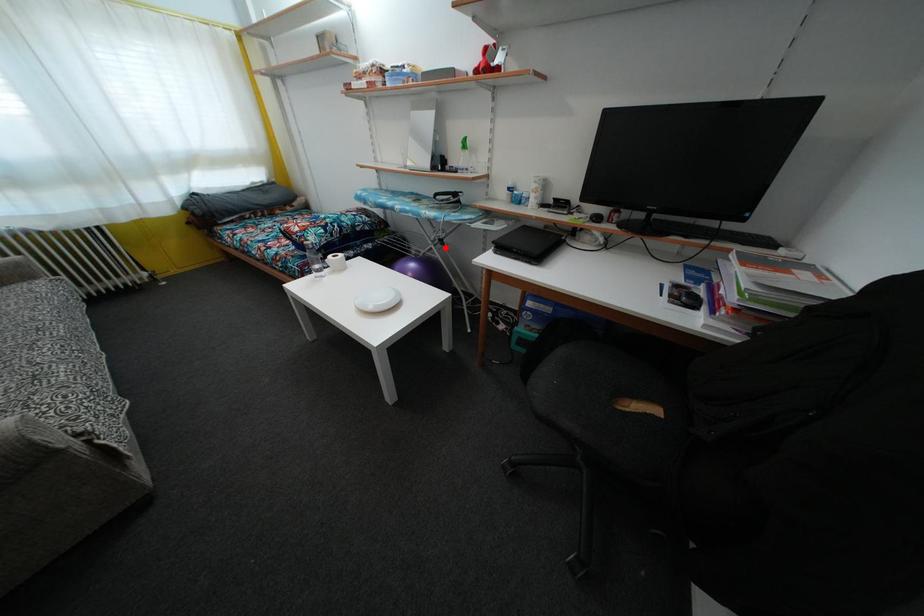
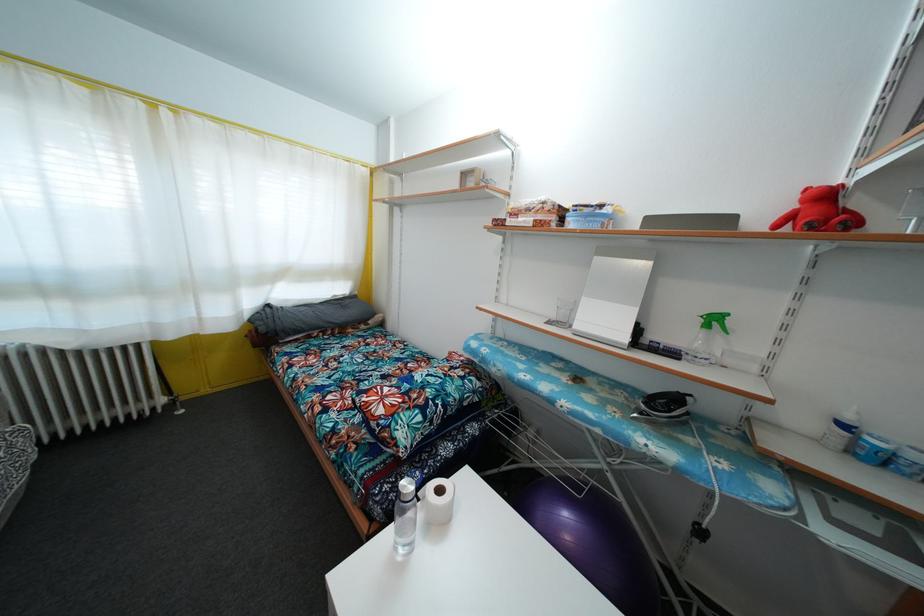
Question: I am providing you with two images of the same scene from different viewpoints. A red point is marked on the first image. At the location where the point appears in image 1, is it still visible in image 2?

Choices:
 (A) Yes
 (B) No

Answer: (A)